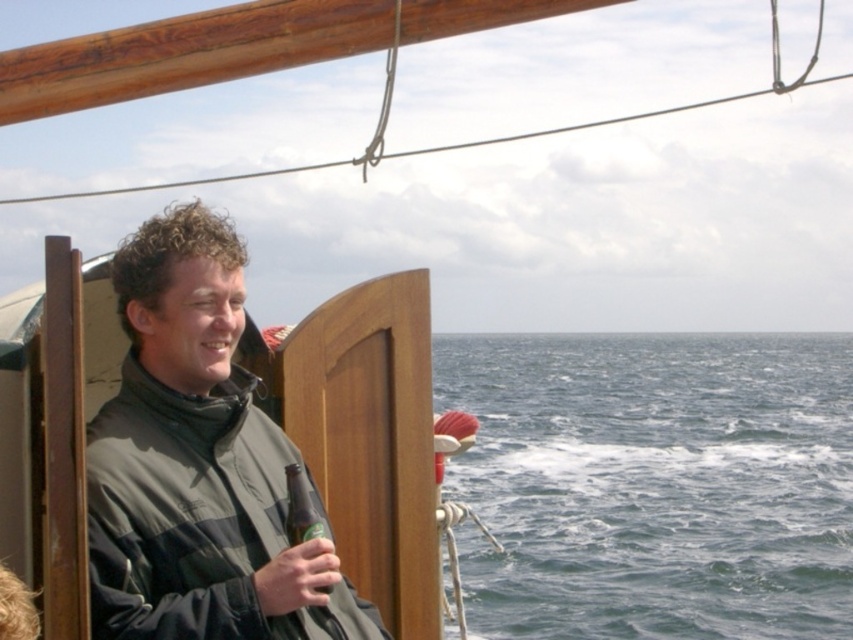
You are a sailor on the boat and want to know which object takes up more space in the image. Based on the scene, can you compare the size of the blue water at lower right and the dark green matte jacket at left?

The blue water at lower right is bigger than the dark green matte jacket at left, so it takes up more space in the image.

You are a photographer on the boat and want to take a photo of the blue water at lower right and dark green matte jacket at left in the same shot. Can you fit both objects in the frame if your camera has a maximum field of view of 20 meters?

The blue water at lower right and dark green matte jacket at left are 21.08 meters apart, which exceeds the camera field of view of 20 meters. Therefore, both objects cannot be captured in the same frame.

You are on a boat and want to move from one point to another. You are currently at point (200,600) and want to go to point (714,484). Is the destination point behind you or in front of you?

The destination point (714,484) is behind point (200,600), so it is behind you.